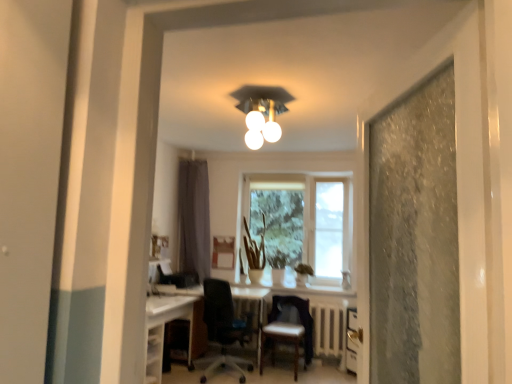
Question: Is white glossy computer desk at lower left in front of or behind black mesh office chair at center, the 2th chair viewed from the right, in the image?

Choices:
 (A) behind
 (B) front

Answer: (A)

Question: From the image's perspective, relative to black mesh office chair at center, the 2th chair viewed from the right, is white glossy computer desk at lower left above or below?

Choices:
 (A) below
 (B) above

Answer: (A)

Question: Which object is positioned farthest from the leather-like brown chair at center, the first chair positioned from the right?

Choices:
 (A) white glossy light fixture at upper center
 (B) transparent glass window at center
 (C) white glossy computer desk at lower left
 (D) black mesh office chair at center, which ranks as the first chair in left-to-right order
 (E) gray fabric curtain at center

Answer: (A)

Question: Considering the real-world distances, which object is farthest from the white glossy computer desk at lower left?

Choices:
 (A) white glossy light fixture at upper center
 (B) leather-like brown chair at center, which is the 2th chair in left-to-right order
 (C) gray fabric curtain at center
 (D) black mesh office chair at center, the 2th chair viewed from the right
 (E) transparent glass window at center

Answer: (E)